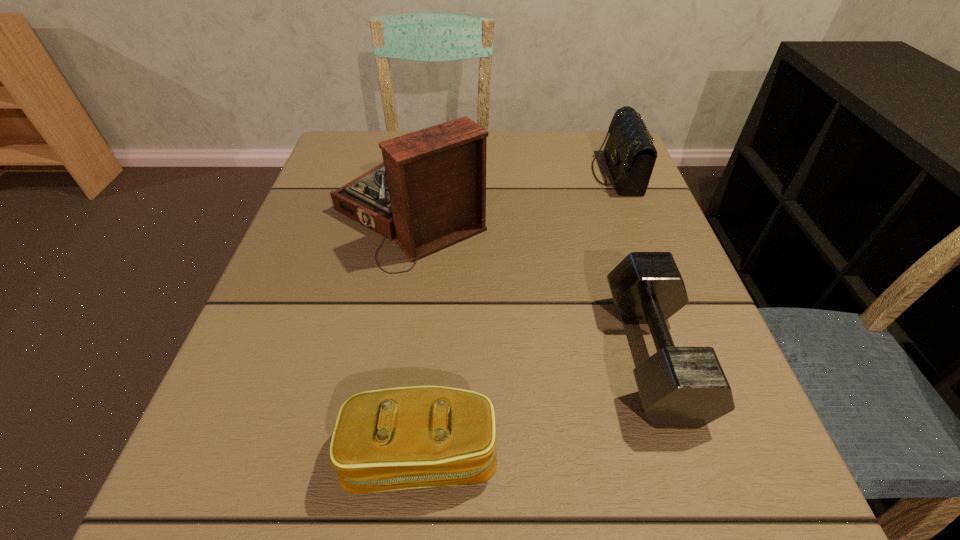
This screenshot has width=960, height=540. In order to click on vacant space that is in between the tallest object and the dumbbell in this screenshot , I will do `click(532, 284)`.

Find the location of a particular element. Image resolution: width=960 pixels, height=540 pixels. free spot between the shorter clutch bag and the right clutch bag is located at coordinates (519, 315).

Select which object is the second closest to the taller clutch bag. Please provide its 2D coordinates. Your answer should be formatted as a tuple, i.e. [(x, y)], where the tuple contains the x and y coordinates of a point satisfying the conditions above.

[(680, 387)]

Locate which object is the third closest to the tallest object. Please provide its 2D coordinates. Your answer should be formatted as a tuple, i.e. [(x, y)], where the tuple contains the x and y coordinates of a point satisfying the conditions above.

[(400, 438)]

Locate an element on the screen. blank area in the image that satisfies the following two spatial constraints: 1. on the front side of the dumbbell; 2. on the right side of the phonograph record is located at coordinates coord(385,355).

The image size is (960, 540). In order to click on vacant space that satisfies the following two spatial constraints: 1. on the front flap of the right clutch bag; 2. on the front side of the dumbbell in this screenshot , I will do `click(687, 355)`.